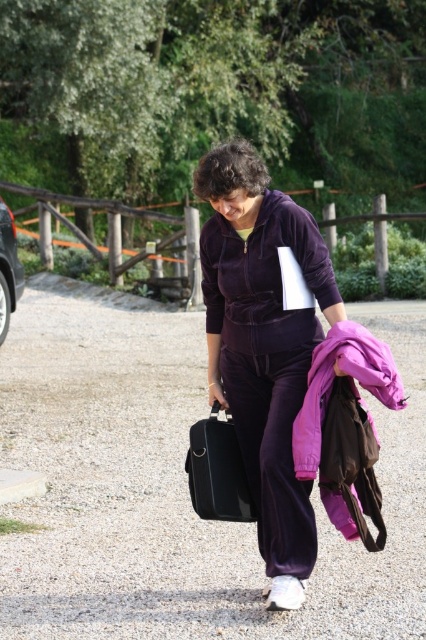
Is black leather briefcase at center thinner than metallic silver car at left?

Incorrect, black leather briefcase at center's width is not less than metallic silver car at left's.

Can you confirm if black leather briefcase at center is positioned to the right of metallic silver car at left?

Indeed, black leather briefcase at center is positioned on the right side of metallic silver car at left.

Where is `black leather briefcase at center`? Image resolution: width=426 pixels, height=640 pixels. black leather briefcase at center is located at coordinates (218, 470).

Where is `black leather briefcase at center`? The height and width of the screenshot is (640, 426). black leather briefcase at center is located at coordinates (218, 470).

Is velvet purple tracksuit at center above metallic silver car at left?

Incorrect, velvet purple tracksuit at center is not positioned above metallic silver car at left.

Between velvet purple tracksuit at center and metallic silver car at left, which one is positioned higher?

metallic silver car at left

What are the coordinates of `velvet purple tracksuit at center` in the screenshot? It's located at (262, 346).

Does velvet purple tracksuit at center have a smaller size compared to black leather briefcase at center?

Actually, velvet purple tracksuit at center might be larger than black leather briefcase at center.

Who is lower down, velvet purple tracksuit at center or black leather briefcase at center?

Positioned lower is black leather briefcase at center.

Where is `velvet purple tracksuit at center`? Image resolution: width=426 pixels, height=640 pixels. velvet purple tracksuit at center is located at coordinates (262, 346).